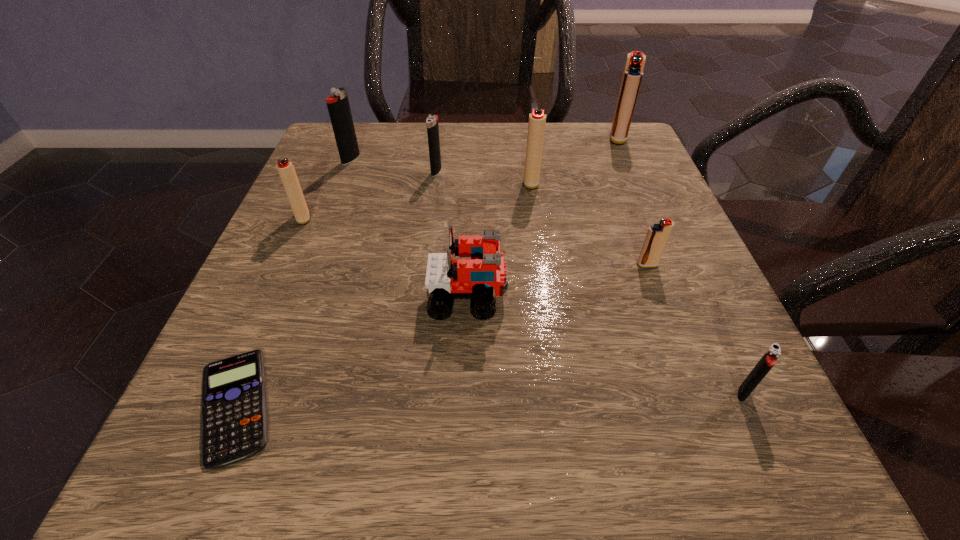
The image size is (960, 540). Identify the location of red igniter that is the second closest to the leftmost igniter. (657, 236).

Find the location of `red igniter that can be found as the closest to the second farthest black igniter`. red igniter that can be found as the closest to the second farthest black igniter is located at coordinates (536, 127).

I want to click on black igniter that is the second closest one to the second smallest black igniter, so click(769, 359).

Image resolution: width=960 pixels, height=540 pixels. Find the location of `black igniter that can be found as the second closest to the second smallest red igniter`. black igniter that can be found as the second closest to the second smallest red igniter is located at coordinates coord(432,126).

This screenshot has width=960, height=540. I want to click on blank space that satisfies the following two spatial constraints: 1. on the front side of the third igniter from left to right; 2. on the right side of the farthest black igniter, so click(347, 171).

The height and width of the screenshot is (540, 960). What are the coordinates of `free spot that satisfies the following two spatial constraints: 1. on the front-facing side of the third nearest object; 2. on the left side of the smallest black igniter` in the screenshot? It's located at (466, 393).